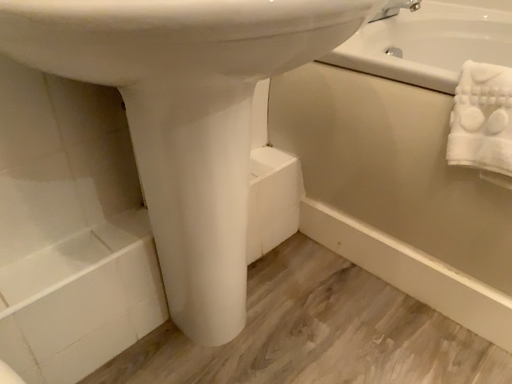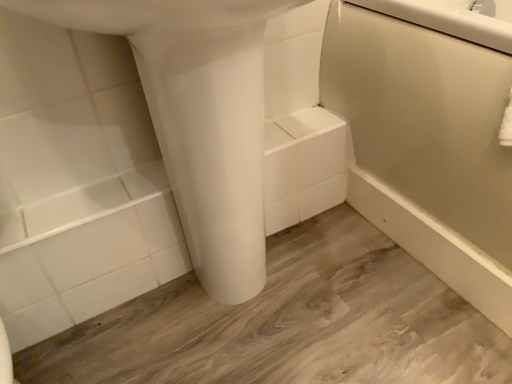
Question: How did the camera likely rotate when shooting the video?

Choices:
 (A) rotated right
 (B) rotated left

Answer: (B)